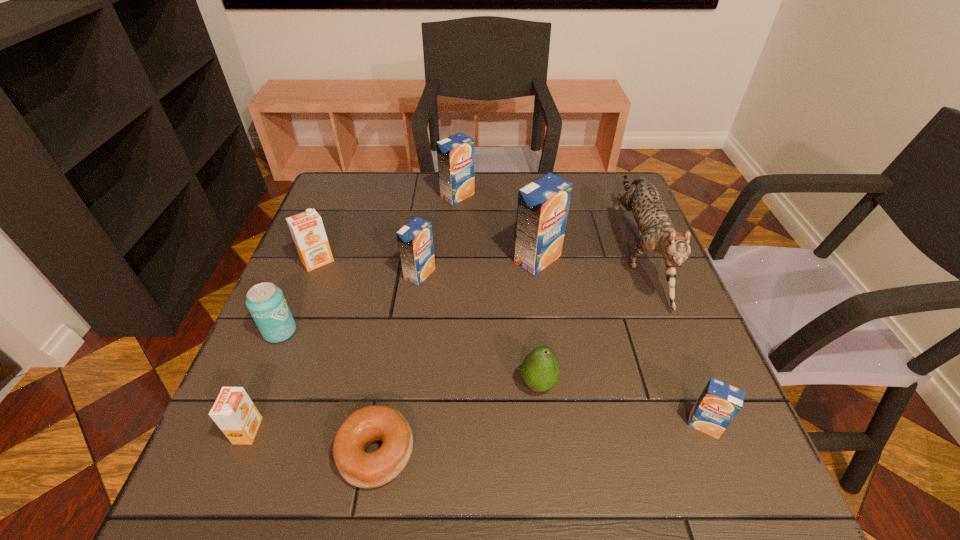
You are a GUI agent. You are given a task and a screenshot of the screen. Output one action in this format:
    pyautogui.click(x=<x>, y=<y>)
    Task: Click on the rightmost blue orange_juice
    Image resolution: width=960 pixels, height=540 pixels.
    Given the screenshot: What is the action you would take?
    pos(719,403)

Locate an element on the screen. The height and width of the screenshot is (540, 960). the smallest blue orange_juice is located at coordinates (719, 403).

I want to click on the nearer orange orange juice, so click(233, 411).

The width and height of the screenshot is (960, 540). Identify the location of the shortest object. (376, 423).

You are a GUI agent. You are given a task and a screenshot of the screen. Output one action in this format:
    pyautogui.click(x=<x>, y=<y>)
    Task: Click on the vacant area situated on the back of the second orange juice from right to left
    
    Given the screenshot: What is the action you would take?
    pyautogui.click(x=532, y=219)

Image resolution: width=960 pixels, height=540 pixels. In order to click on blank space located 0.350m on the face of the cat in this screenshot , I will do `click(725, 476)`.

Identify the location of free space located 0.400m on the right of the farthest orange juice. The height and width of the screenshot is (540, 960). point(608,196).

Identify the location of vacant space positioned 0.120m on the right of the third biggest blue orange_juice. (484, 274).

This screenshot has width=960, height=540. What are the coordinates of `free space located 0.200m on the front of the bigger orange orange juice` in the screenshot? It's located at (288, 336).

I want to click on blank area located 0.220m on the right of the beer can, so click(398, 332).